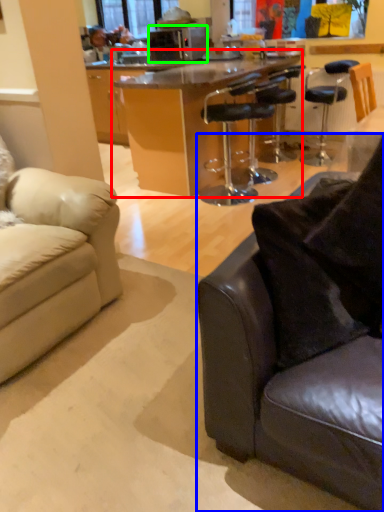
Question: Which is nearer to the table (highlighted by a red box)? studio couch (highlighted by a blue box) or microwave oven (highlighted by a green box).

Choices:
 (A) studio couch
 (B) microwave oven

Answer: (B)